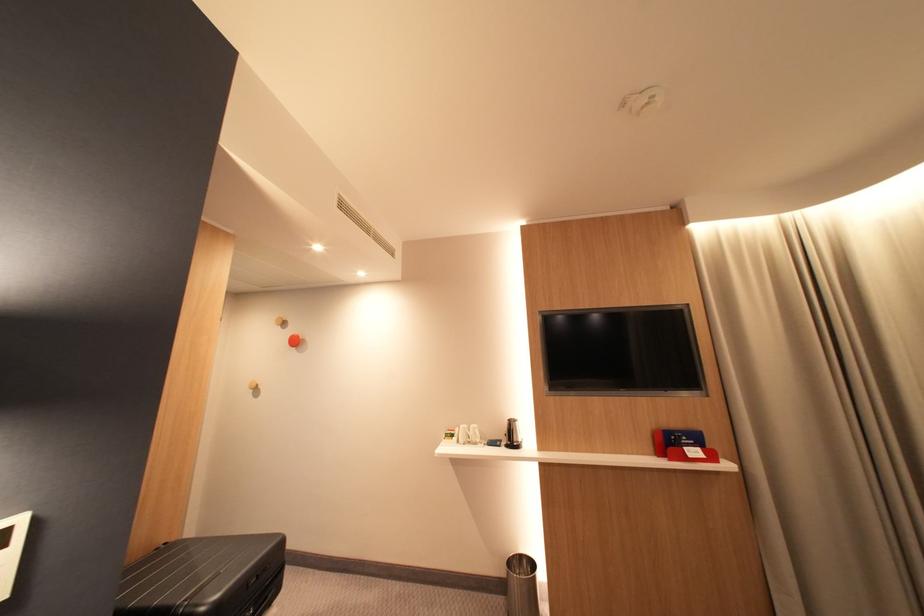
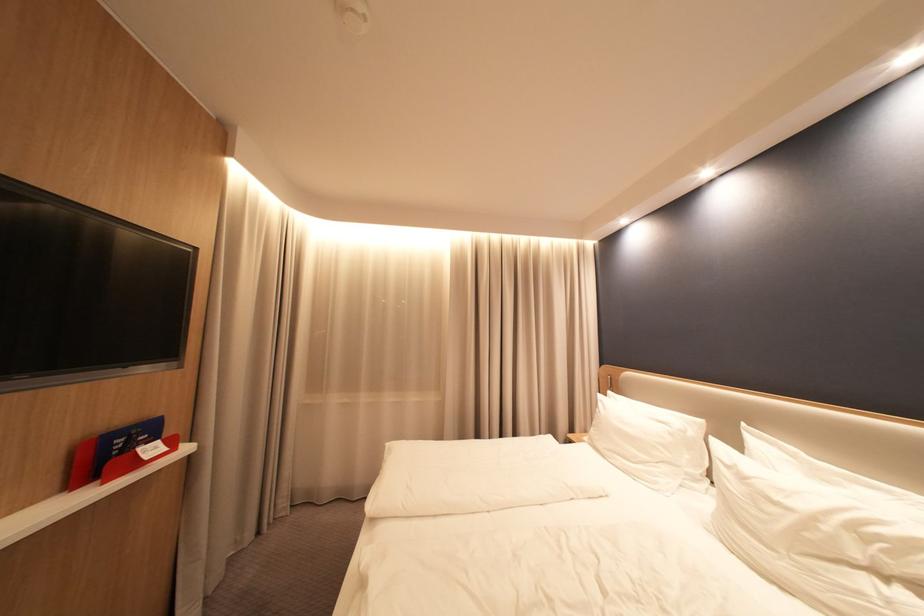
Locate, in the second image, the point that corresponds to [696,450] in the first image.

(150, 452)